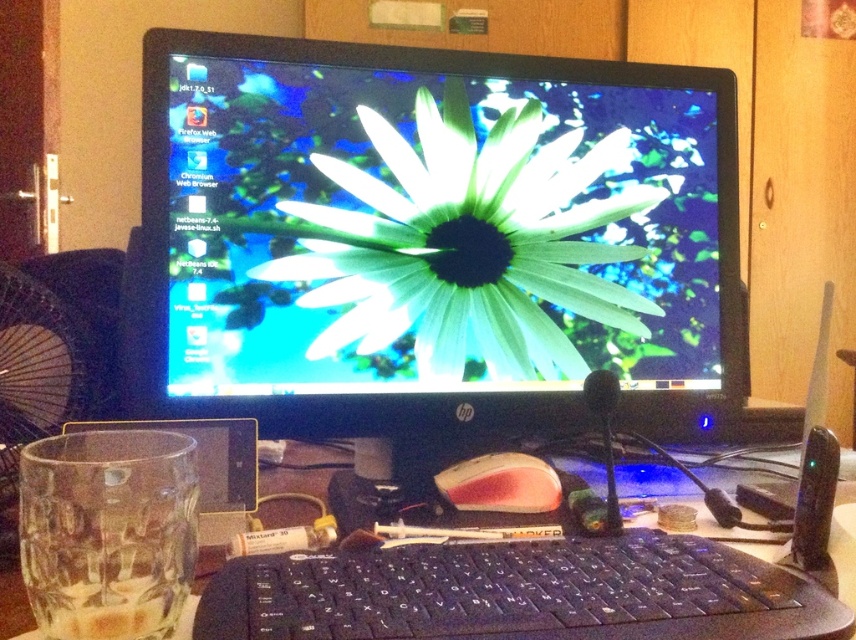
You are a user trying to reach the black plastic keyboard at lower center without moving your chair. Can you easily access it while focusing on the green matte flower at center?

The green matte flower at center is further to the viewer than the black plastic keyboard at lower center, meaning the keyboard is closer to you. Since the keyboard is closer, you can easily access it without moving your chair while focusing on the flower.

You are setting up a new webcam that needs to capture both the green matte flower at center and the black plastic keyboard at lower center clearly. Based on their positions, which object should the webcam be angled towards to ensure both are in frame?

The webcam should be angled towards the green matte flower at center since it is positioned on the right side of the black plastic keyboard at lower center, so centering the camera between them would capture both.

You are organizing your desk and need to place the black plastic keyboard at lower center and the pink matte mouse at center. If the desk space is limited, which object should you consider moving to a different location to save space?

The black plastic keyboard at lower center is bigger than the pink matte mouse at center, so you should consider moving the black plastic keyboard at lower center to save space.